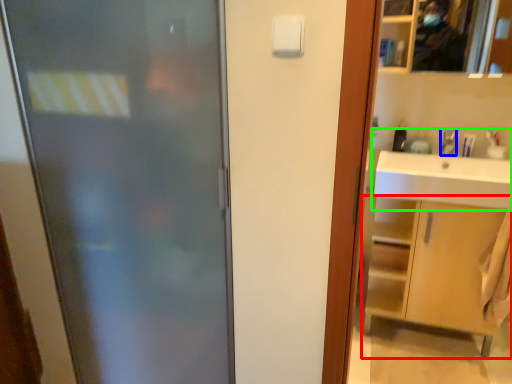
Question: Which object is positioned closest to bathroom cabinet (highlighted by a red box)? Select from faucet (highlighted by a blue box) and sink (highlighted by a green box).

Choices:
 (A) faucet
 (B) sink

Answer: (B)